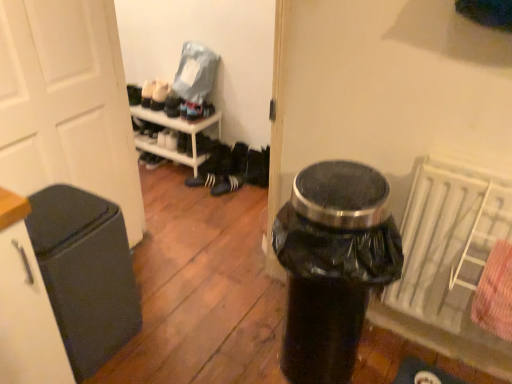
What are the coordinates of `empty space that is in between black matte trash can at left and black plastic trash can at center` in the screenshot? It's located at [x=190, y=335].